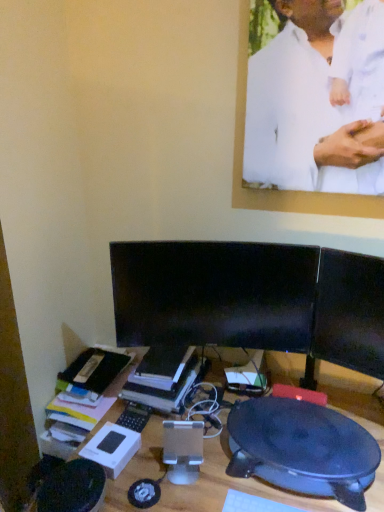
Question: Considering the positions of white matte shirt at upper center and black plastic desk at center in the image, is white matte shirt at upper center wider or thinner than black plastic desk at center?

Choices:
 (A) wide
 (B) thin

Answer: (B)

Question: Is white matte shirt at upper center inside or outside of black plastic desk at center?

Choices:
 (A) inside
 (B) outside

Answer: (B)

Question: Which object is positioned closest to the black glossy monitor at center, the second computer monitor positioned from the right?

Choices:
 (A) black glossy monitor at center, which is the second computer monitor in left-to-right order
 (B) black plastic desk at center
 (C) white matte shirt at upper center
 (D) hardcover book at center
 (E) black plastic round table at lower right

Answer: (A)

Question: Estimate the real-world distances between objects in this image. Which object is farther from the black plastic round table at lower right?

Choices:
 (A) hardcover book at center
 (B) white matte shirt at upper center
 (C) black glossy monitor at center, positioned as the first computer monitor in right-to-left order
 (D) black plastic desk at center
 (E) black glossy monitor at center, which is the first computer monitor in left-to-right order

Answer: (B)